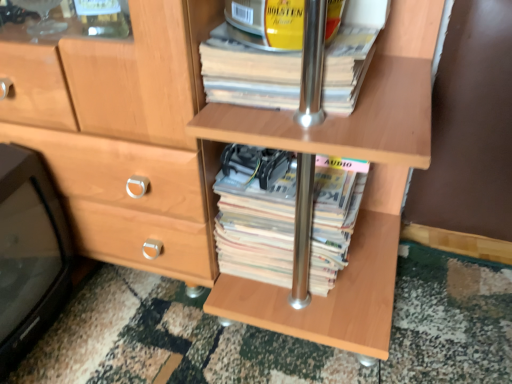
Question: From the image's perspective, is white paper at center, placed as the 1th paperback book when sorted from bottom to top, on yellow paper at upper center, placed as the 1th paperback book when sorted from top to bottom?

Choices:
 (A) yes
 (B) no

Answer: (B)

Question: From a real-world perspective, is white paper at center, placed as the 1th paperback book when sorted from bottom to top, positioned under yellow paper at upper center, placed as the 1th paperback book when sorted from top to bottom, based on gravity?

Choices:
 (A) yes
 (B) no

Answer: (A)

Question: From the image's perspective, is white paper at center, placed as the 1th paperback book when sorted from bottom to top, below yellow paper at upper center, placed as the 1th paperback book when sorted from top to bottom?

Choices:
 (A) yes
 (B) no

Answer: (A)

Question: Considering the relative sizes of white paper at center, the second paperback book viewed from the top, and yellow paper at upper center, which is the second paperback book from bottom to top, in the image provided, is white paper at center, the second paperback book viewed from the top, bigger than yellow paper at upper center, which is the second paperback book from bottom to top,?

Choices:
 (A) no
 (B) yes

Answer: (B)

Question: From a real-world perspective, is white paper at center, the second paperback book viewed from the top, positioned over yellow paper at upper center, placed as the 1th paperback book when sorted from top to bottom, based on gravity?

Choices:
 (A) no
 (B) yes

Answer: (A)

Question: Does white paper at center, placed as the 1th paperback book when sorted from bottom to top, appear on the left side of yellow paper at upper center, placed as the 1th paperback book when sorted from top to bottom?

Choices:
 (A) yes
 (B) no

Answer: (B)

Question: Can white paper at center, placed as the 1th paperback book when sorted from bottom to top, be found inside black plastic tv at lower left?

Choices:
 (A) yes
 (B) no

Answer: (B)

Question: Is black plastic tv at lower left outside of white paper at center, placed as the 1th paperback book when sorted from bottom to top?

Choices:
 (A) no
 (B) yes

Answer: (B)

Question: Is black plastic tv at lower left far away from white paper at center, the second paperback book viewed from the top?

Choices:
 (A) yes
 (B) no

Answer: (B)

Question: From the image's perspective, is black plastic tv at lower left under white paper at center, the second paperback book viewed from the top?

Choices:
 (A) no
 (B) yes

Answer: (B)

Question: Does black plastic tv at lower left turn towards white paper at center, placed as the 1th paperback book when sorted from bottom to top?

Choices:
 (A) yes
 (B) no

Answer: (B)

Question: Is black plastic tv at lower left at the left side of white paper at center, placed as the 1th paperback book when sorted from bottom to top?

Choices:
 (A) yes
 (B) no

Answer: (A)

Question: Can you confirm if yellow paper at upper center, which is the second paperback book from bottom to top, is shorter than black plastic tv at lower left?

Choices:
 (A) no
 (B) yes

Answer: (B)